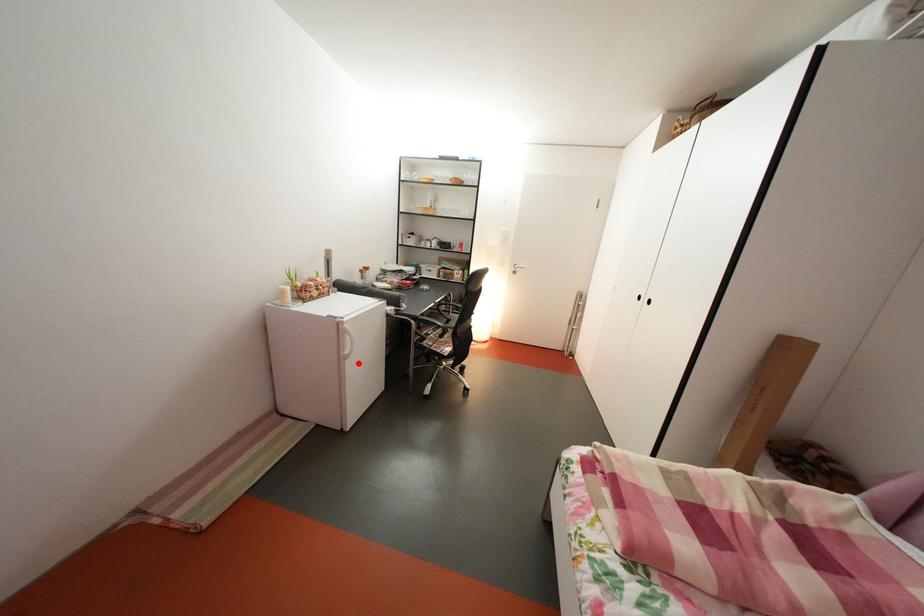
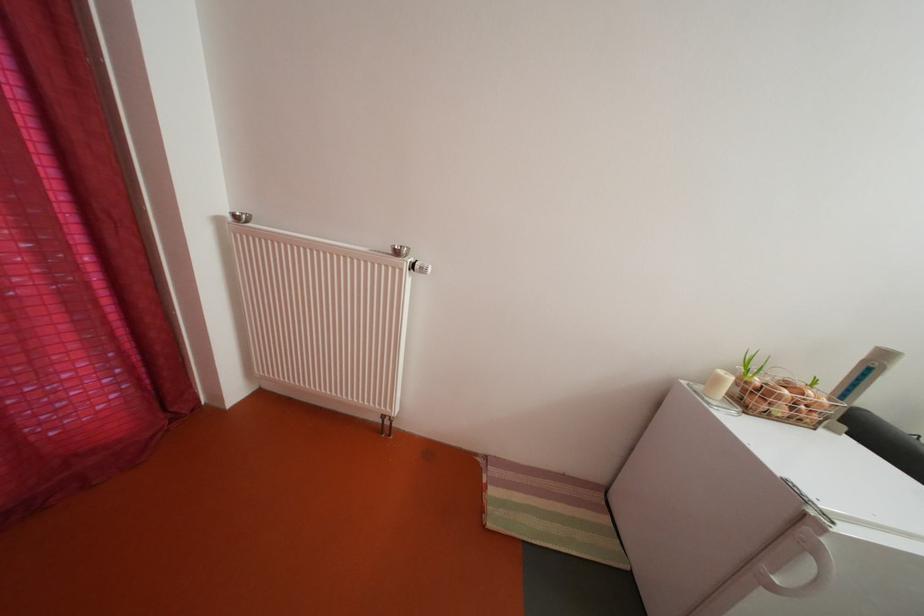
Question: I am providing you with two images of the same scene from different viewpoints. A red point is marked on the first image. Can you still see the location of the red point in image 2?

Choices:
 (A) Yes
 (B) No

Answer: (A)